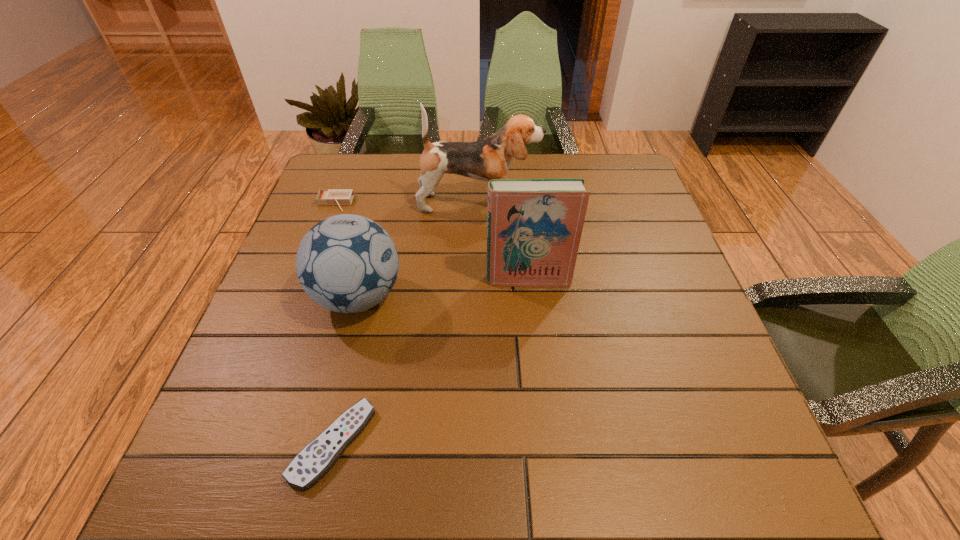
This screenshot has height=540, width=960. I want to click on blank area in the image that satisfies the following two spatial constraints: 1. on the side with brand of the soccer ball; 2. on the left side of the remote control, so click(x=321, y=443).